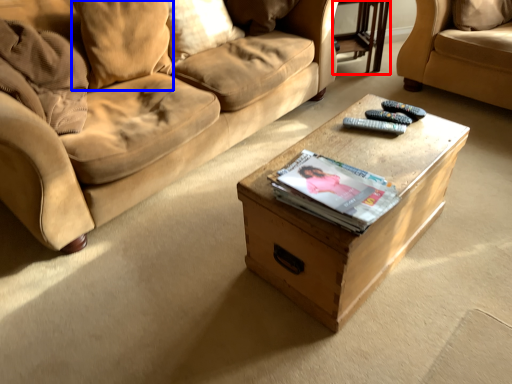
Question: Which object is further to the camera taking this photo, glass table (highlighted by a red box) or pillow (highlighted by a blue box)?

Choices:
 (A) glass table
 (B) pillow

Answer: (A)